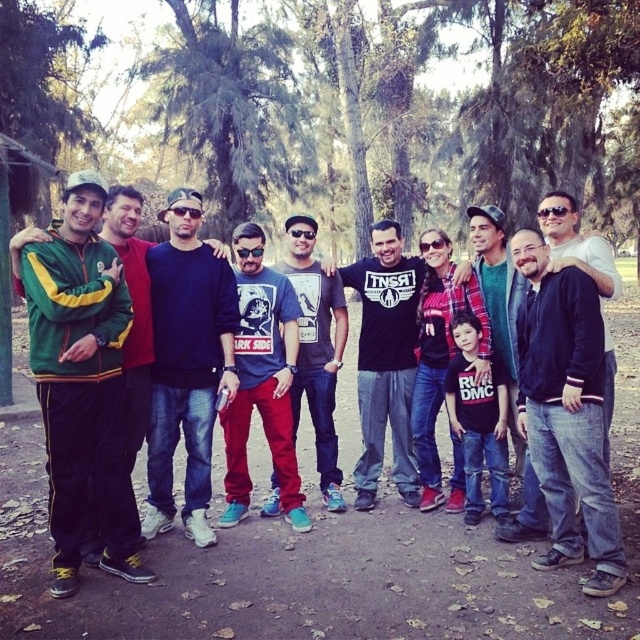
Question: Which point is closer to the camera taking this photo?

Choices:
 (A) (403, 410)
 (B) (566, 428)

Answer: (B)

Question: Can you confirm if dark gray cotton t-shirt at center is bigger than matte black shirt at center?

Choices:
 (A) no
 (B) yes

Answer: (B)

Question: Among these points, which one is nearest to the camera?

Choices:
 (A) (x=541, y=406)
 (B) (x=260, y=394)
 (C) (x=570, y=260)
 (D) (x=296, y=269)

Answer: (C)

Question: Is black t-shirt at center to the left of dark gray cotton t-shirt at center from the viewer's perspective?

Choices:
 (A) yes
 (B) no

Answer: (B)

Question: Does green/yellow track suit at left come behind matte black shirt at center?

Choices:
 (A) yes
 (B) no

Answer: (A)

Question: Which of the following is the closest to the observer?

Choices:
 (A) (13, 252)
 (B) (186, 275)
 (C) (564, 492)
 (D) (280, 426)

Answer: (A)